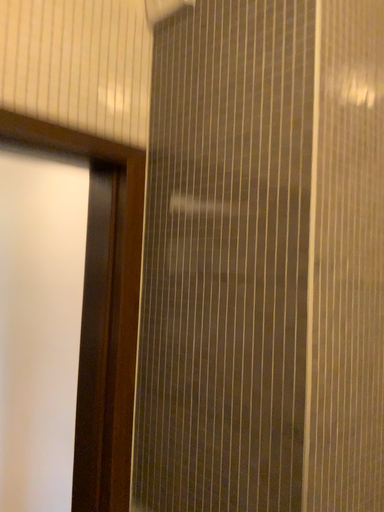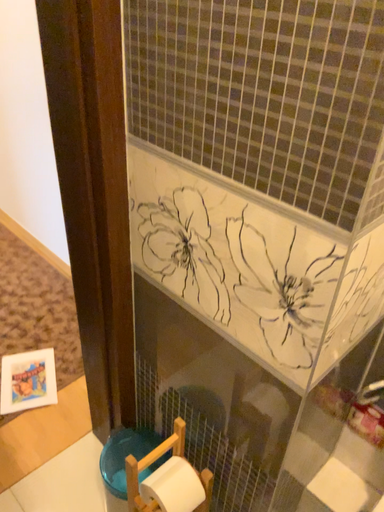
Question: Which way did the camera rotate in the video?

Choices:
 (A) rotated downward
 (B) rotated upward

Answer: (A)